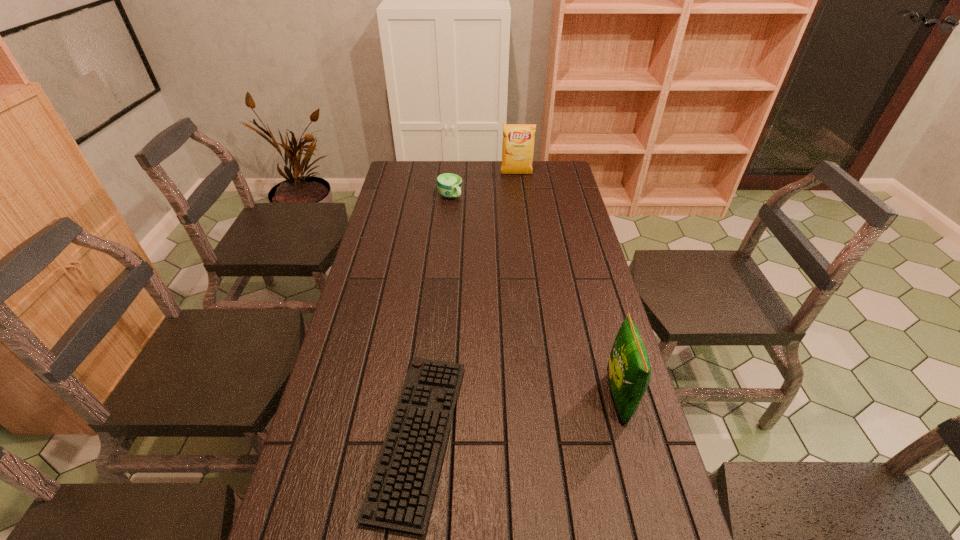
Identify the location of free spot between the shortest object and the third nearest object. This screenshot has width=960, height=540. (434, 316).

The width and height of the screenshot is (960, 540). I want to click on free space between the shortest object and the second object from right to left, so click(468, 305).

Find the location of `empty space that is in between the third tallest object and the left crisp (potato chip)`. empty space that is in between the third tallest object and the left crisp (potato chip) is located at coordinates (483, 185).

The height and width of the screenshot is (540, 960). Identify the location of blank region between the computer keyboard and the cup. (434, 316).

I want to click on vacant area that lies between the farther crisp (potato chip) and the nearer crisp (potato chip), so click(x=567, y=286).

At what (x,y) coordinates should I click in order to perform the action: click on vacant space in between the nearer crisp (potato chip) and the left crisp (potato chip). Please return your answer as a coordinate pair (x, y). This screenshot has height=540, width=960. Looking at the image, I should click on (567, 286).

This screenshot has width=960, height=540. In order to click on free point between the cup and the rightmost object in this screenshot , I will do `click(534, 297)`.

What are the coordinates of `vacant space in between the nearer crisp (potato chip) and the farther crisp (potato chip)` in the screenshot? It's located at (567, 286).

Identify the location of vacant region between the farthest object and the shortest object. (468, 305).

The height and width of the screenshot is (540, 960). What are the coordinates of `vacant space in between the rightmost object and the third object from left to right` in the screenshot? It's located at (x=567, y=286).